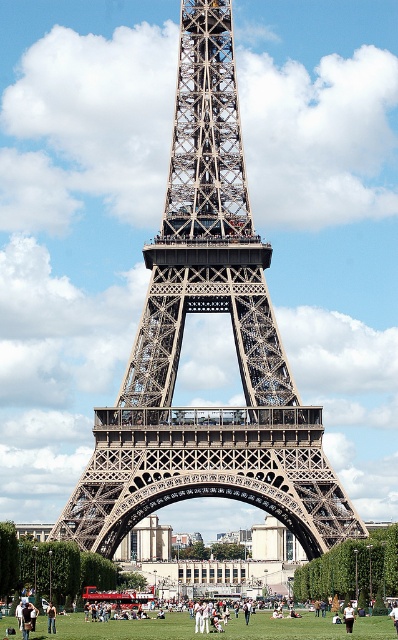
The height and width of the screenshot is (640, 398). Describe the element at coordinates (181, 339) in the screenshot. I see `metallic lattice structure at center` at that location.

Locate an element on the screen. metallic lattice structure at center is located at coordinates point(181,339).

Is point (271, 417) positioned after point (48, 602)?

Yes, point (271, 417) is farther from viewer.

In order to click on metallic lattice structure at center in this screenshot , I will do `click(181, 339)`.

Is point (243, 621) more distant than point (347, 625)?

Yes, point (243, 621) is behind point (347, 625).

Does green grass at lower center come behind white cotton shirt at center?

No, green grass at lower center is closer to the viewer.

Find the location of `green grass at lower center`. green grass at lower center is located at coordinates (216, 632).

At what (x,y) coordinates should I click in order to perform the action: click on green grass at lower center. Please return your answer as a coordinate pair (x, y). Looking at the image, I should click on (216, 632).

Does point (265, 620) lie in front of point (46, 608)?

No, (265, 620) is further to viewer.

Who is shorter, green grass at center or skinny jeans at center?

Standing shorter between the two is skinny jeans at center.

Does point (177, 620) lie behind point (52, 612)?

Yes, it is.

At what (x,y) coordinates should I click in order to perform the action: click on green grass at center. Please return your answer as a coordinate pair (x, y). Looking at the image, I should click on (218, 632).